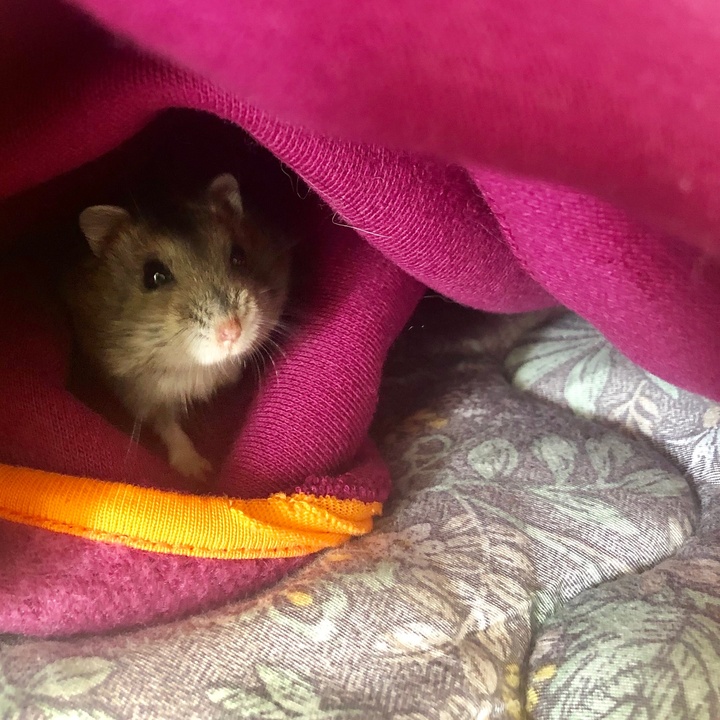
Where is `yellow rim of blanket`? The width and height of the screenshot is (720, 720). yellow rim of blanket is located at coordinates (160, 523).